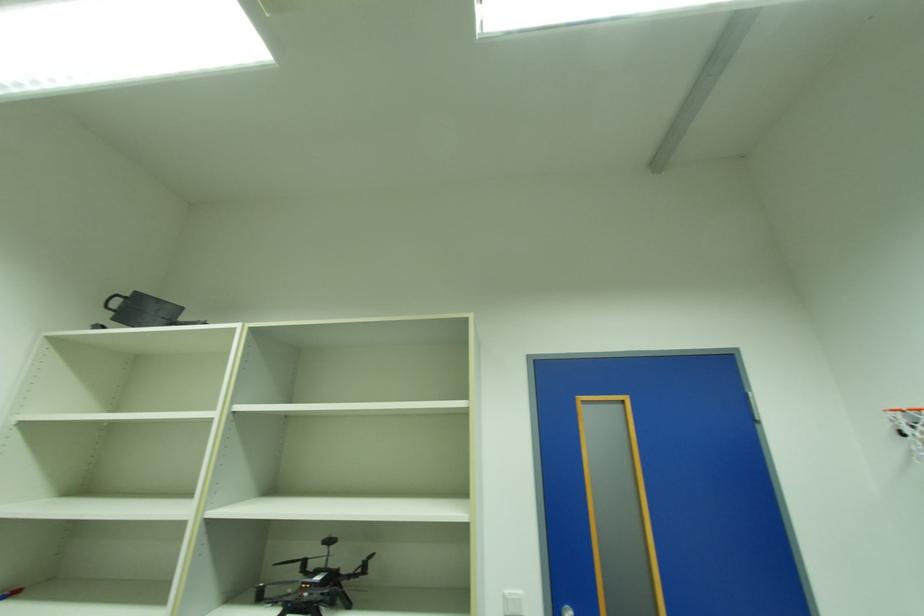
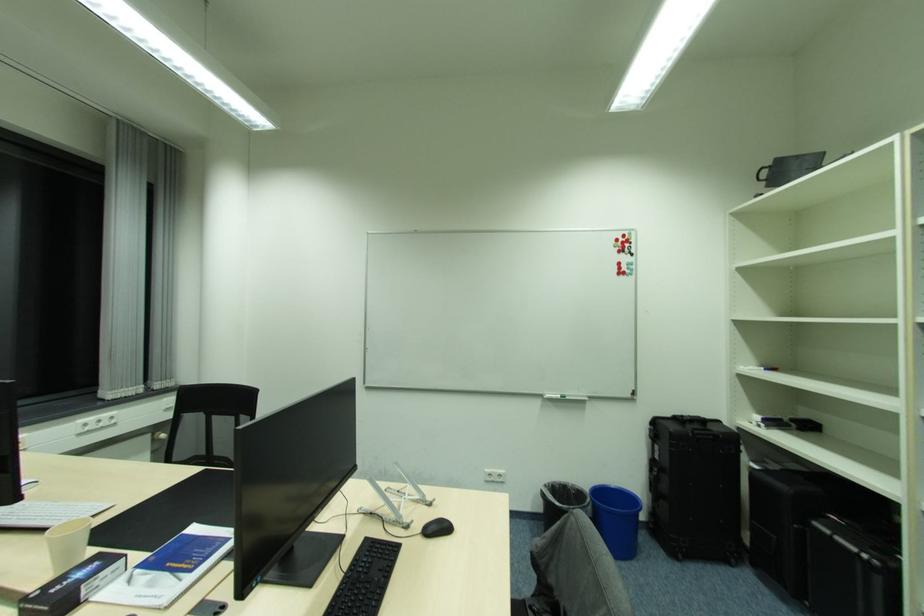
Question: The first image is from the beginning of the video and the second image is from the end. How did the camera likely rotate when shooting the video?

Choices:
 (A) Left
 (B) Right
 (C) Up
 (D) Down

Answer: (A)